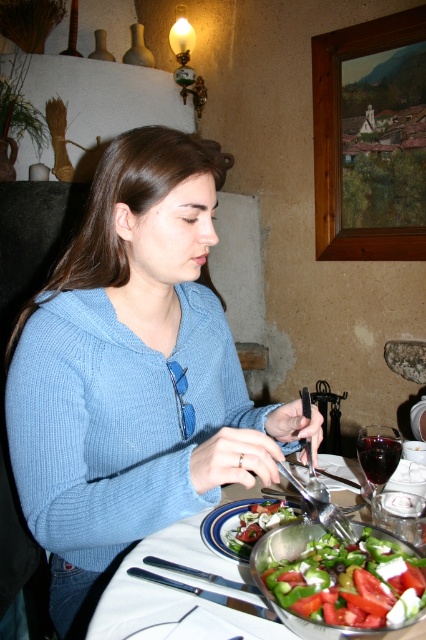
Question: Which of the following is the closest to the observer?

Choices:
 (A) blue knitted sweater at center
 (B) fresh green leafy salad at lower right

Answer: (B)

Question: From the image, what is the correct spatial relationship of blue knitted sweater at center in relation to fresh green leafy salad at lower right?

Choices:
 (A) above
 (B) below

Answer: (A)

Question: Can you confirm if blue knitted sweater at center is positioned above wooden picture frame at upper right?

Choices:
 (A) yes
 (B) no

Answer: (B)

Question: Which object appears farthest from the camera in this image?

Choices:
 (A) blue knitted sweater at center
 (B) fresh green leafy salad at lower right
 (C) green leafy salad at center

Answer: (C)

Question: Does blue knitted sweater at center have a greater width compared to fresh green leafy salad at lower right?

Choices:
 (A) yes
 (B) no

Answer: (A)

Question: Which object is the closest to the green leafy salad at center?

Choices:
 (A) wooden picture frame at upper right
 (B) fresh green leafy salad at lower right
 (C) blue knitted sweater at center
 (D) glassy plastic salad bowl at center

Answer: (D)